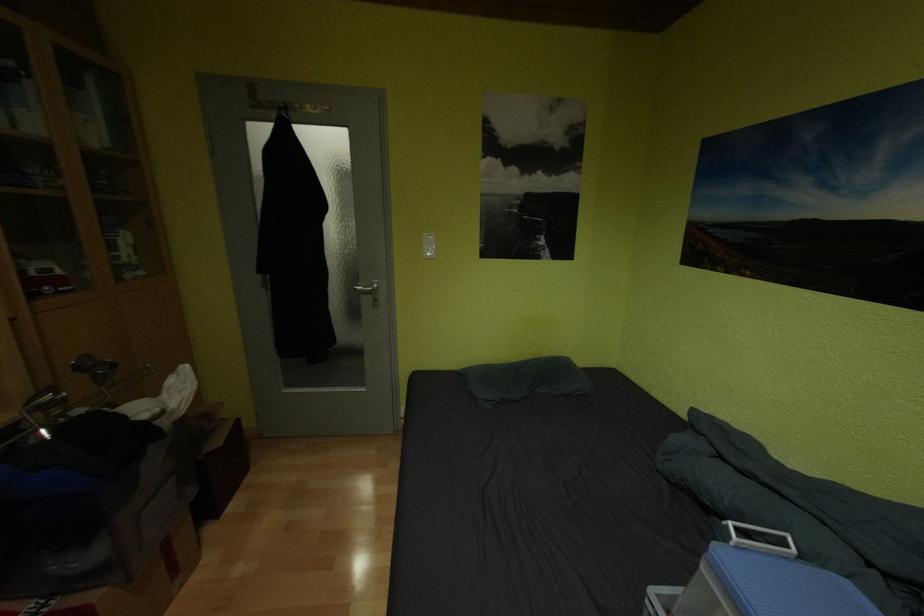
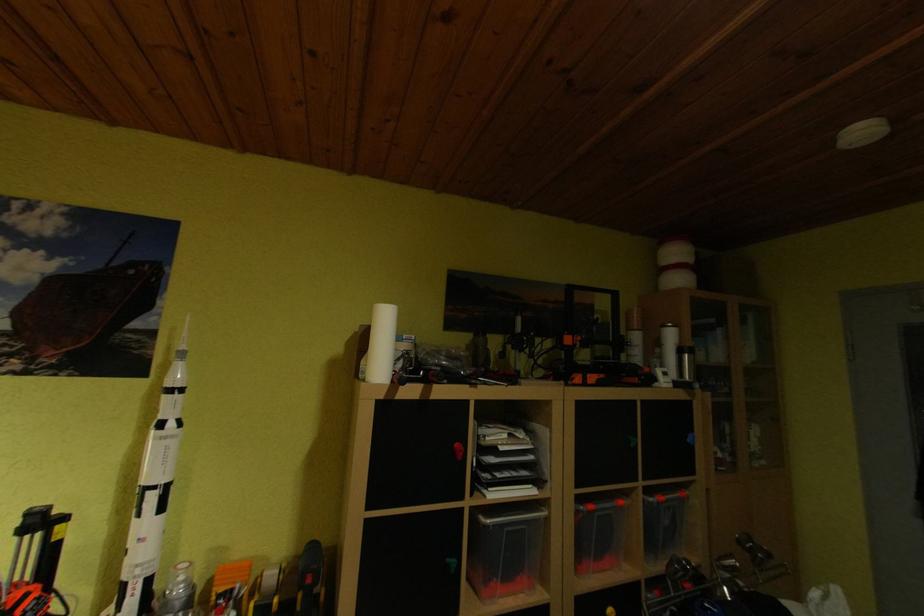
Question: How did the camera likely rotate?

Choices:
 (A) Left
 (B) Right
 (C) Up
 (D) Down

Answer: (A)